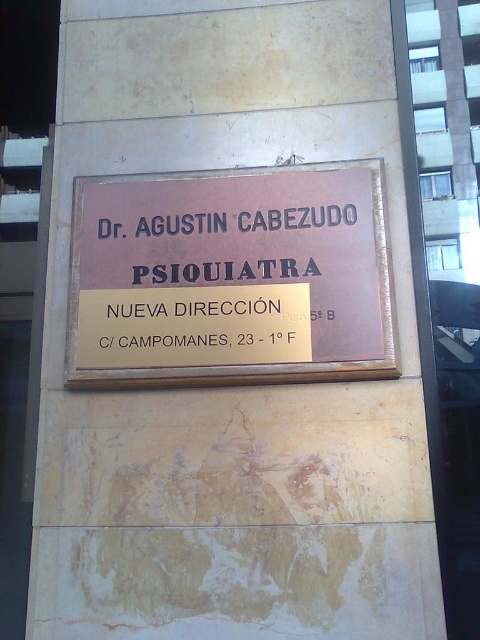
You are a patient trying to locate Dr. AGUSTIN CABEZUDO. You see the brown polished wood sign at center and the gold metallic sign at center. Which one should you focus on first to find the updated address information?

The brown polished wood sign at center is in front of the gold metallic sign at center, so you should focus on the brown polished wood sign at center first to find the updated address information.

You are a patient trying to read the address on the signboard. The brown polished wood sign at center and the gold metallic sign at center are part of the same signboard. How far apart are these two sections?

The brown polished wood sign at center and the gold metallic sign at center are 2.08 inches apart.